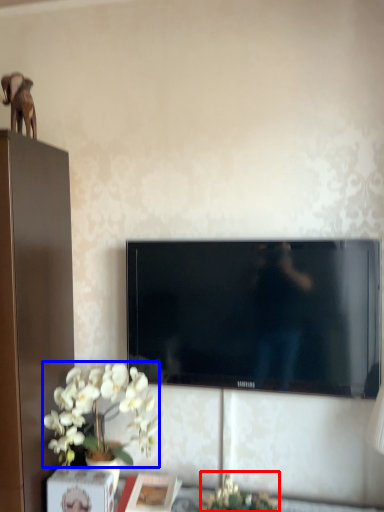
Question: Which of the following is the farthest to the observer, plant (highlighted by a red box) or flower (highlighted by a blue box)?

Choices:
 (A) plant
 (B) flower

Answer: (B)